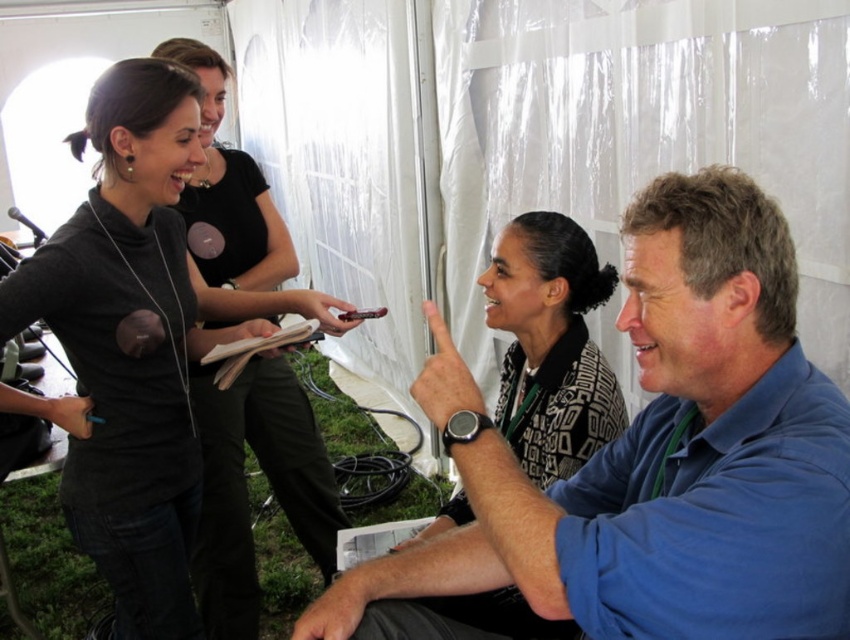
Identify the location of blue cotton shirt at center. The height and width of the screenshot is (640, 850). (650, 460).

Does blue cotton shirt at center appear over dark gray turtleneck at upper left?

No.

This screenshot has height=640, width=850. I want to click on blue cotton shirt at center, so click(650, 460).

Is blue cotton shirt at center bigger than patterned fabric blouse at center?

Indeed, blue cotton shirt at center has a larger size compared to patterned fabric blouse at center.

Can you confirm if blue cotton shirt at center is shorter than patterned fabric blouse at center?

Incorrect, blue cotton shirt at center's height does not fall short of patterned fabric blouse at center's.

Find the location of a particular element. blue cotton shirt at center is located at coordinates (650, 460).

Where is `blue cotton shirt at center`? Image resolution: width=850 pixels, height=640 pixels. blue cotton shirt at center is located at coordinates (650, 460).

Can you confirm if dark gray turtleneck at upper left is positioned below patterned fabric blouse at center?

No.

Who is taller, dark gray turtleneck at upper left or patterned fabric blouse at center?

dark gray turtleneck at upper left

Who is more distant from viewer, (77, 337) or (595, 428)?

→ Positioned behind is point (595, 428).

The width and height of the screenshot is (850, 640). What are the coordinates of `dark gray turtleneck at upper left` in the screenshot? It's located at (128, 346).